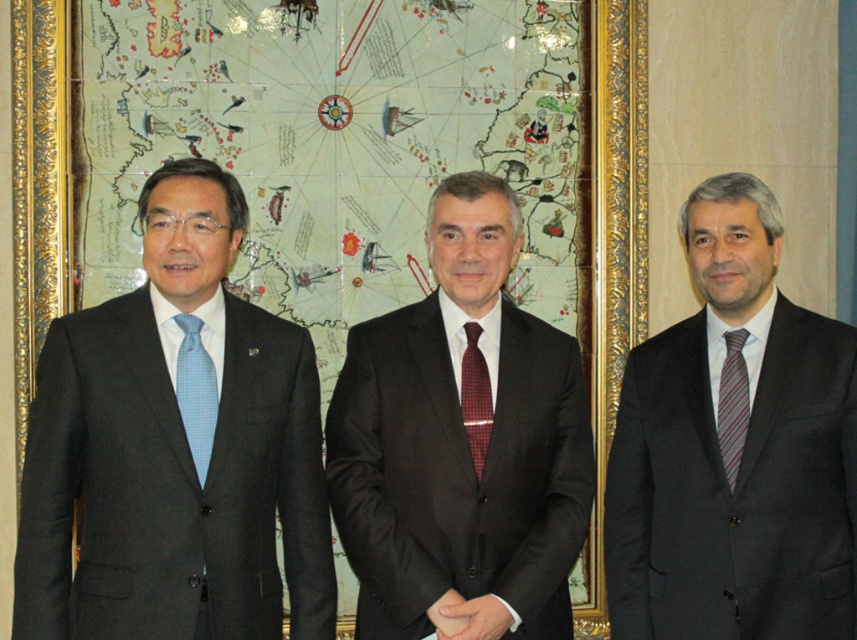
Question: Can you confirm if light blue textured tie at left is positioned to the left of maroon textured tie at center?

Choices:
 (A) yes
 (B) no

Answer: (A)

Question: Is the position of dark gray suit at center less distant than that of maroon textured tie at center?

Choices:
 (A) yes
 (B) no

Answer: (A)

Question: Based on their relative distances, which object is farther from the dark gray suit at right?

Choices:
 (A) maroon textured tie at center
 (B) gold-framed picture at center
 (C) dark gray suit at center

Answer: (B)

Question: Which object appears closest to the camera in this image?

Choices:
 (A) dark gray suit at right
 (B) maroon textured tie at center
 (C) matte black suit at left

Answer: (C)

Question: Observing the image, what is the correct spatial positioning of dark gray suit at right in reference to dark gray suit at center?

Choices:
 (A) right
 (B) left

Answer: (A)

Question: Among these objects, which one is farthest from the camera?

Choices:
 (A) dark gray suit at center
 (B) striped silk tie at right
 (C) dark gray suit at right
 (D) maroon textured tie at center

Answer: (D)